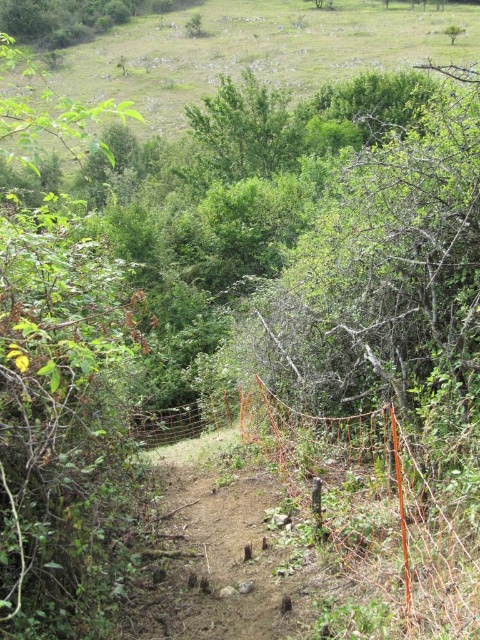
You are standing at the highest point of the valley and want to walk to the point that is closer to you. Which point should you head towards, point (x=369, y=548) or point (x=204, y=420)?

You should head towards point (x=369, y=548) because it is closer to the viewer than point (x=204, y=420).

You are standing at the center of the dirt path looking towards the valley. Where is the orange wire mesh at center located in relation to your position?

The orange wire mesh at center is located at the point with coordinates 0.798 in the x direction and 0.794 in the y direction relative to your position at the center of the dirt path.